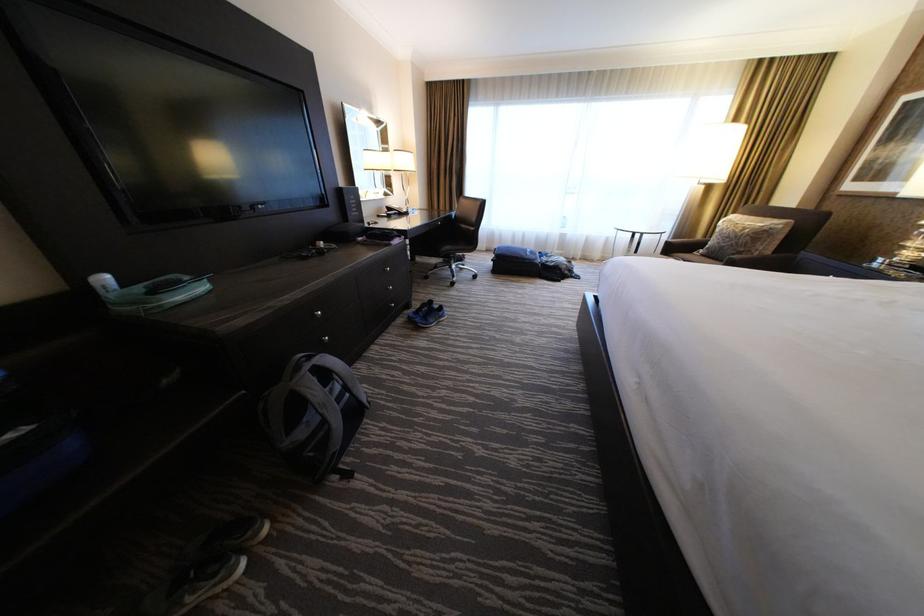
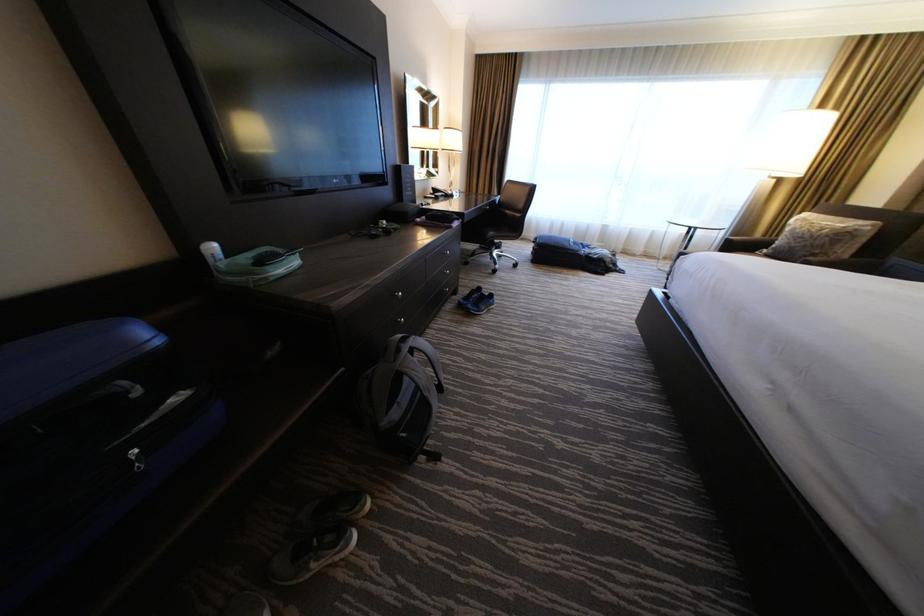
Question: Based on the continuous images, in which direction is the camera rotating? Reply with the corresponding letter.

Choices:
 (A) Left
 (B) Right
 (C) Up
 (D) Down

Answer: (D)